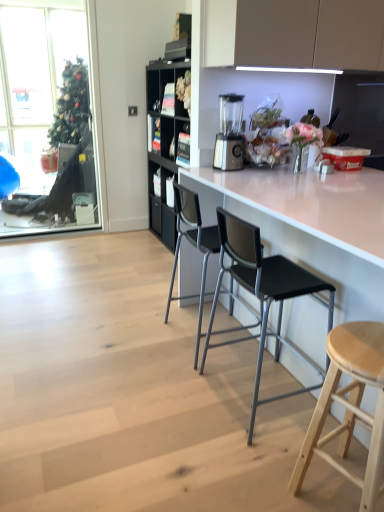
Where is `vacant space situated on the left part of black plastic chair at center, the 1th chair in the back-to-front sequence`? The width and height of the screenshot is (384, 512). vacant space situated on the left part of black plastic chair at center, the 1th chair in the back-to-front sequence is located at coordinates (127, 333).